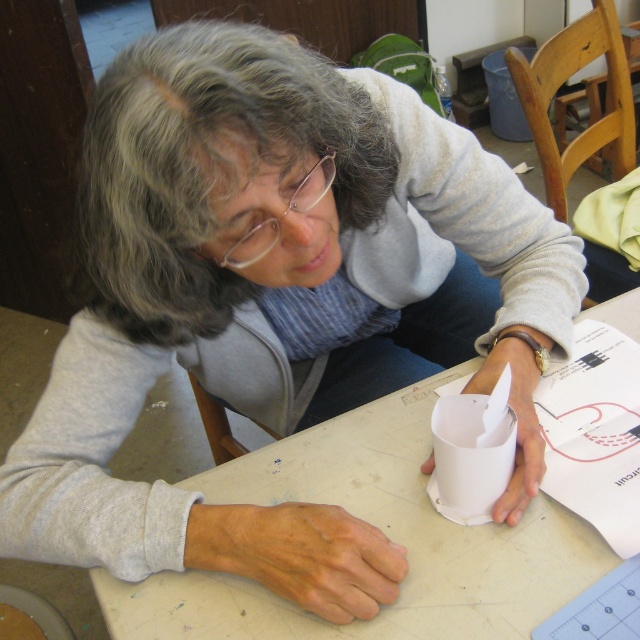
Is point (314, 67) closer to camera compared to point (323, 636)?

Yes, it is in front of point (323, 636).

The height and width of the screenshot is (640, 640). I want to click on gray matte hair at upper center, so click(209, 166).

Is white paper at center below white paper at lower right?

Indeed, white paper at center is positioned under white paper at lower right.

Who is shorter, white paper at center or white paper at lower right?

Standing shorter between the two is white paper at lower right.

Who is more forward, (476, 618) or (628, 552)?

Point (476, 618) is more forward.

What are the coordinates of `white paper at center` in the screenshot? It's located at (385, 532).

Which is behind, point (360, 136) or point (563, 500)?

The point (563, 500) is behind.

Is gray matte hair at upper center wider than white paper at lower right?

Yes, gray matte hair at upper center is wider than white paper at lower right.

Locate an element on the screen. The image size is (640, 640). gray matte hair at upper center is located at coordinates (209, 166).